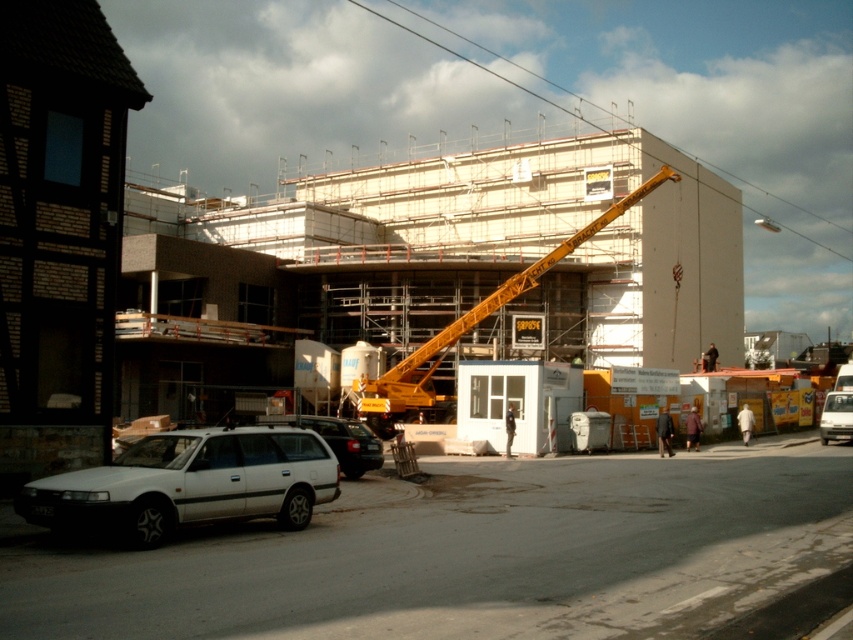
You are a delivery driver who needs to park your car 12 meters away from the construction site entrance. You see the white matte wagon at lower left in the scene. Can you park your car behind it to meet the required distance?

The white matte wagon at lower left is 11.60 meters away from the camera, so parking behind it would place your car slightly closer than the required 12 meters. You need to park further back to meet the distance requirement.

You are standing at the construction site and want to reach a specific point marked at coordinates point (392, 428). You have a drone that can fly up to 30 meters. Can your drone reach that point?

The distance of point (392, 428) from viewer is 36.03 meters, so the drone cannot reach it as its maximum range is 30 meters.

Looking at this image, you are a delivery driver who needs to park your truck between the white matte wagon at lower left and the white matte van at lower right. Considering their widths, which vehicle should you park closer to to ensure enough space for your truck?

Since the white matte wagon at lower left is wider than the white matte van at lower right, you should park closer to the white matte van at lower right to allow enough space for your truck.